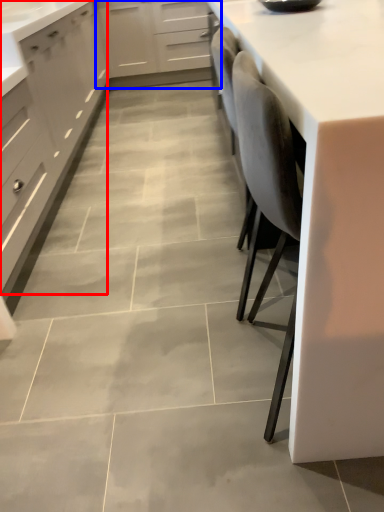
Question: Among these objects, which one is farthest to the camera, cabinetry (highlighted by a red box) or cabinetry (highlighted by a blue box)?

Choices:
 (A) cabinetry
 (B) cabinetry

Answer: (B)